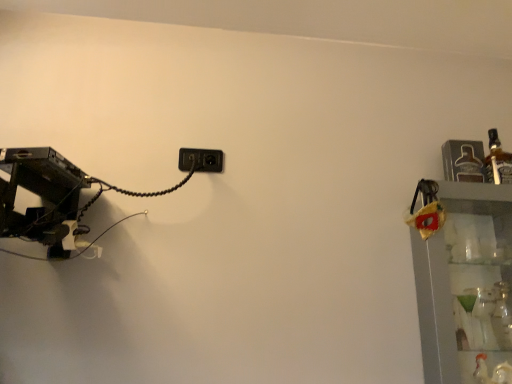
Question: Should I look upward or downward to see black plastic power plugs and sockets at center?

Choices:
 (A) up
 (B) down

Answer: (A)

Question: Is clear glass shelves at right aimed at black plastic power plugs and sockets at center?

Choices:
 (A) yes
 (B) no

Answer: (B)

Question: Would you say black plastic power plugs and sockets at center is part of clear glass shelves at right's contents?

Choices:
 (A) no
 (B) yes

Answer: (A)

Question: Is clear glass shelves at right bigger than black plastic power plugs and sockets at center?

Choices:
 (A) yes
 (B) no

Answer: (A)

Question: Does clear glass shelves at right have a greater width compared to black plastic power plugs and sockets at center?

Choices:
 (A) yes
 (B) no

Answer: (A)

Question: From the image's perspective, would you say clear glass shelves at right is positioned over black plastic power plugs and sockets at center?

Choices:
 (A) no
 (B) yes

Answer: (A)

Question: Is clear glass shelves at right in contact with black plastic power plugs and sockets at center?

Choices:
 (A) no
 (B) yes

Answer: (A)

Question: Does clear glass shelves at right have a lesser height compared to translucent glass bottle at upper right?

Choices:
 (A) yes
 (B) no

Answer: (B)

Question: From the image's perspective, is clear glass shelves at right above translucent glass bottle at upper right?

Choices:
 (A) no
 (B) yes

Answer: (A)

Question: Is clear glass shelves at right placed right next to translucent glass bottle at upper right?

Choices:
 (A) yes
 (B) no

Answer: (B)

Question: From a real-world perspective, is clear glass shelves at right physically below translucent glass bottle at upper right?

Choices:
 (A) yes
 (B) no

Answer: (A)

Question: Is clear glass shelves at right looking in the opposite direction of translucent glass bottle at upper right?

Choices:
 (A) no
 (B) yes

Answer: (A)

Question: Is clear glass shelves at right to the left of translucent glass bottle at upper right from the viewer's perspective?

Choices:
 (A) no
 (B) yes

Answer: (B)

Question: Can you confirm if black plastic power plugs and sockets at center is smaller than clear glass shelves at right?

Choices:
 (A) yes
 (B) no

Answer: (A)